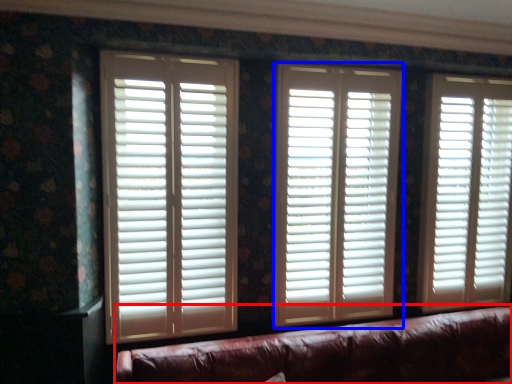
Question: Which of the following is the farthest to the observer, studio couch (highlighted by a red box) or window blind (highlighted by a blue box)?

Choices:
 (A) studio couch
 (B) window blind

Answer: (B)